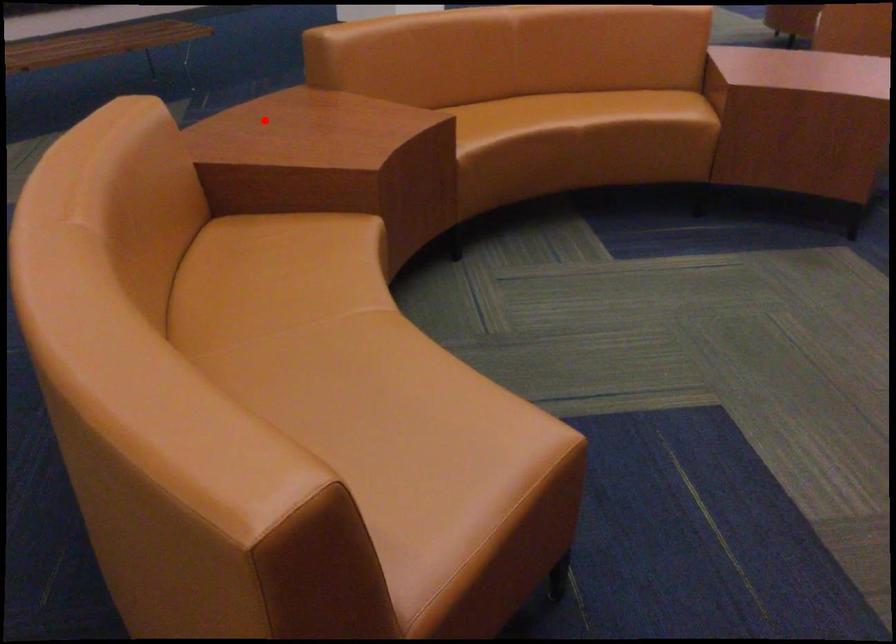
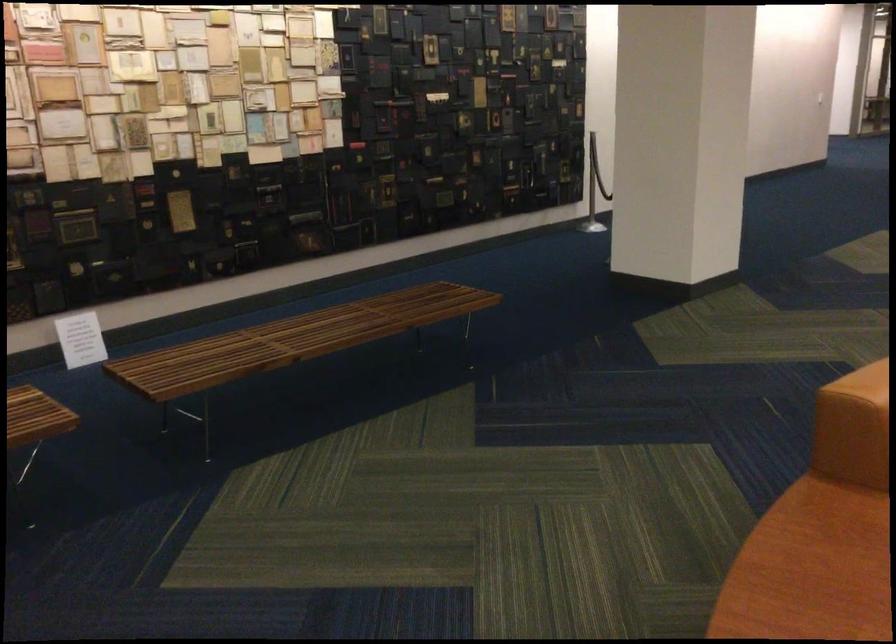
Locate, in the second image, the point that corresponds to the highlighted location in the first image.

(811, 569)